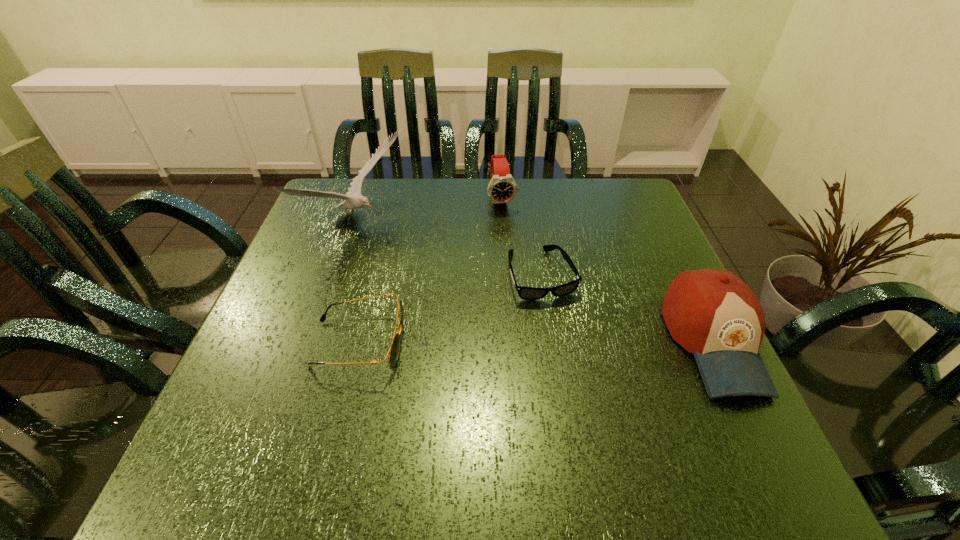
Where is `vacant space positioned 0.220m on the face of the watch`? The width and height of the screenshot is (960, 540). vacant space positioned 0.220m on the face of the watch is located at coordinates (519, 267).

The height and width of the screenshot is (540, 960). I want to click on free space located 0.260m on the front-facing side of the shortest object, so [596, 411].

Where is `vacant space located on the front-facing side of the shortest object`? The width and height of the screenshot is (960, 540). vacant space located on the front-facing side of the shortest object is located at coordinates (565, 335).

Identify the location of free spot located 0.270m on the front-facing side of the shortest object. (599, 416).

This screenshot has width=960, height=540. Find the location of `vacant space located 0.380m at the tip of the beak of the tallest object`. vacant space located 0.380m at the tip of the beak of the tallest object is located at coordinates (516, 319).

Identify the location of vacant area located at the tip of the beak of the tallest object. Image resolution: width=960 pixels, height=540 pixels. (500, 310).

You are a GUI agent. You are given a task and a screenshot of the screen. Output one action in this format:
    pyautogui.click(x=<x>, y=<y>)
    Task: Click on the free spot located at the tip of the beak of the tallest object
    Image resolution: width=960 pixels, height=540 pixels.
    Given the screenshot: What is the action you would take?
    pyautogui.click(x=431, y=270)

Identify the location of watch at the far edge. (502, 188).

Where is `gull at the far edge`? Image resolution: width=960 pixels, height=540 pixels. gull at the far edge is located at coordinates (353, 198).

Where is `object that is at the near edge`? Image resolution: width=960 pixels, height=540 pixels. object that is at the near edge is located at coordinates (713, 314).